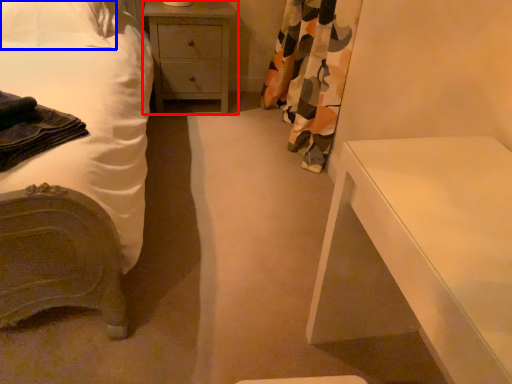
Question: Which of the following is the farthest to the observer, chest of drawers (highlighted by a red box) or pillow (highlighted by a blue box)?

Choices:
 (A) chest of drawers
 (B) pillow

Answer: (A)